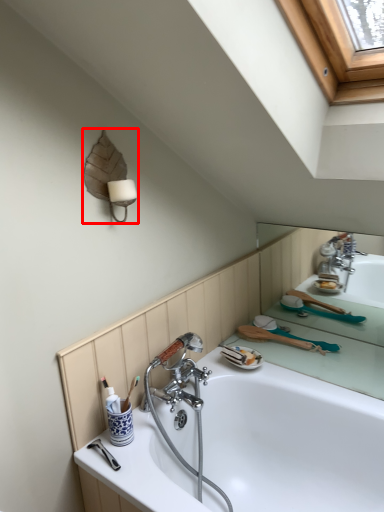
Question: From the image's perspective, where is lamp (annotated by the red box) located in relation to bathtub in the image?

Choices:
 (A) above
 (B) below

Answer: (A)